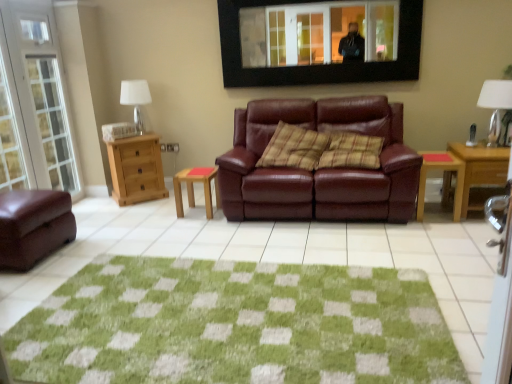
Where is `vacant area that is in front of matte leather couch at center, acting as the second studio couch starting from the left`? vacant area that is in front of matte leather couch at center, acting as the second studio couch starting from the left is located at coordinates (362, 246).